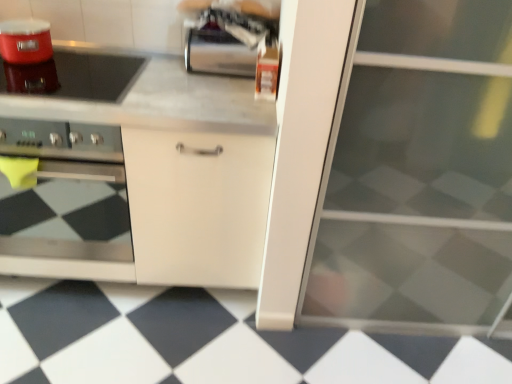
Question: Should I look upward or downward to see transparent glass screen door at right?

Choices:
 (A) down
 (B) up

Answer: (B)

Question: Can you confirm if stainless steel oven at left is thinner than shiny black glass at upper left?

Choices:
 (A) yes
 (B) no

Answer: (B)

Question: Is stainless steel oven at left not close to shiny black glass at upper left?

Choices:
 (A) no
 (B) yes

Answer: (A)

Question: Can you confirm if stainless steel oven at left is smaller than shiny black glass at upper left?

Choices:
 (A) yes
 (B) no

Answer: (B)

Question: Can you confirm if stainless steel oven at left is wider than shiny black glass at upper left?

Choices:
 (A) no
 (B) yes

Answer: (B)

Question: Is stainless steel oven at left further to camera compared to shiny black glass at upper left?

Choices:
 (A) no
 (B) yes

Answer: (A)

Question: Does stainless steel oven at left have a greater height compared to shiny black glass at upper left?

Choices:
 (A) yes
 (B) no

Answer: (A)

Question: Can we say black glossy tile at lower center lies outside white matte cabinet at center?

Choices:
 (A) no
 (B) yes

Answer: (B)

Question: From a real-world perspective, is black glossy tile at lower center positioned over white matte cabinet at center based on gravity?

Choices:
 (A) no
 (B) yes

Answer: (A)

Question: Is the position of black glossy tile at lower center more distant than that of white matte cabinet at center?

Choices:
 (A) yes
 (B) no

Answer: (A)

Question: Is black glossy tile at lower center smaller than white matte cabinet at center?

Choices:
 (A) no
 (B) yes

Answer: (B)

Question: Would you consider black glossy tile at lower center to be distant from white matte cabinet at center?

Choices:
 (A) no
 (B) yes

Answer: (A)

Question: From the image's perspective, would you say black glossy tile at lower center is shown under white matte cabinet at center?

Choices:
 (A) yes
 (B) no

Answer: (A)

Question: Is white matte cabinet at center directly adjacent to stainless steel oven at left?

Choices:
 (A) no
 (B) yes

Answer: (A)